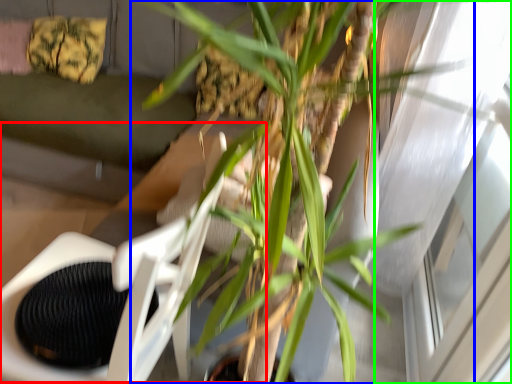
Question: Which object is positioned farthest from swivel chair (highlighted by a red box)? Select from houseplant (highlighted by a blue box) and window (highlighted by a green box).

Choices:
 (A) houseplant
 (B) window

Answer: (B)